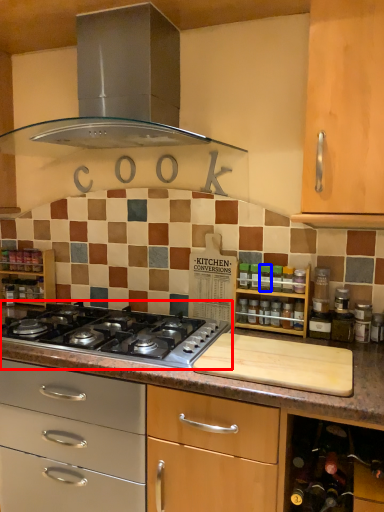
Question: Among these objects, which one is farthest to the camera, gas stove (highlighted by a red box) or bottle (highlighted by a blue box)?

Choices:
 (A) gas stove
 (B) bottle

Answer: (B)